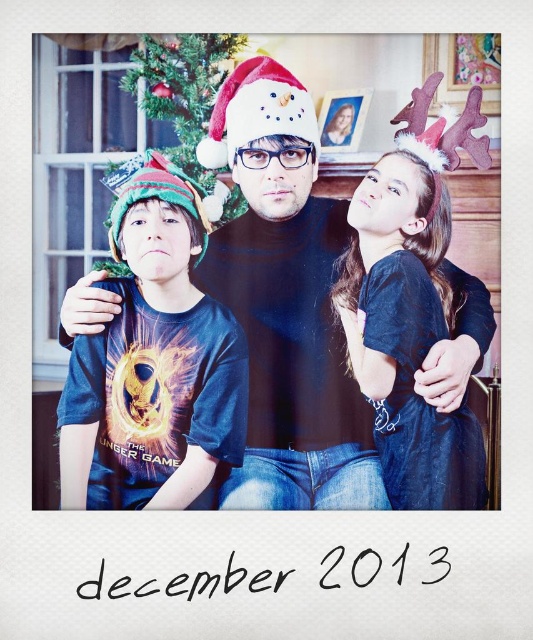
Question: Does blue t-shirt at left have a greater width compared to white matte santa hat at center?

Choices:
 (A) no
 (B) yes

Answer: (B)

Question: Can you confirm if black matte santa hat at center is positioned below dark blue denim jeans at lower right?

Choices:
 (A) no
 (B) yes

Answer: (A)

Question: Which object is positioned farthest from the blue t-shirt at left?

Choices:
 (A) dark blue denim jeans at lower right
 (B) black matte santa hat at center

Answer: (A)

Question: Among these objects, which one is nearest to the camera?

Choices:
 (A) blue t-shirt at left
 (B) multicolored knitted hat at left

Answer: (A)

Question: Is blue t-shirt at left behind dark blue denim jeans at lower right?

Choices:
 (A) no
 (B) yes

Answer: (B)

Question: Which point appears farthest from the camera in this image?

Choices:
 (A) (230, 276)
 (B) (432, 460)

Answer: (A)